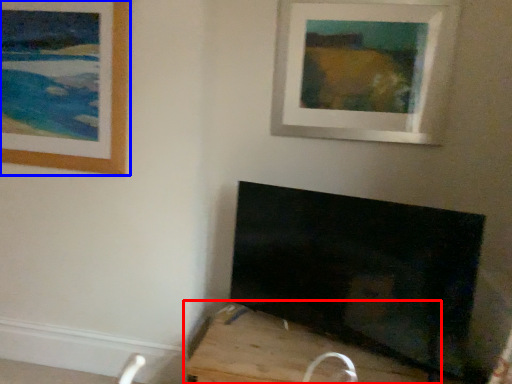
Question: Which object appears closest to the camera in this image, furniture (highlighted by a red box) or picture frame (highlighted by a blue box)?

Choices:
 (A) furniture
 (B) picture frame

Answer: (A)